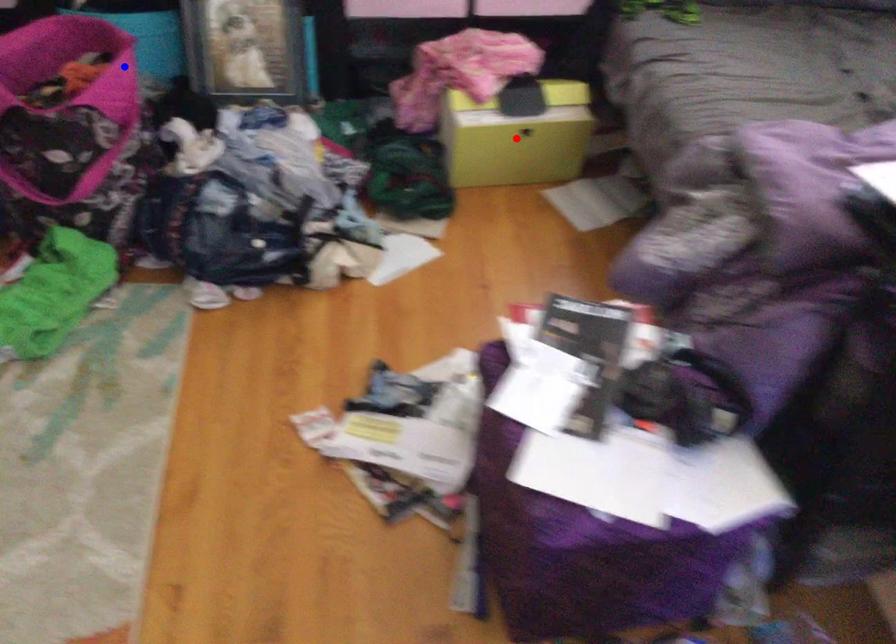
Question: Two points are marked on the image. Which point is closer to the camera?

Choices:
 (A) Blue point is closer.
 (B) Red point is closer.

Answer: (A)